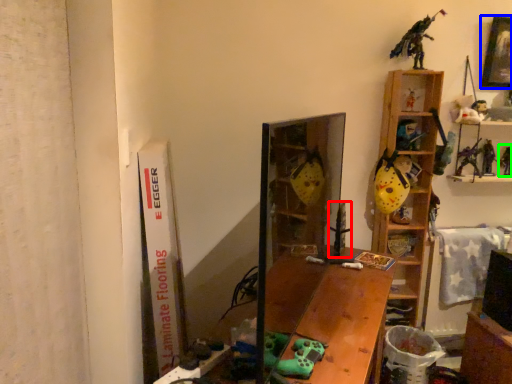
Question: Estimate the real-world distances between objects in this image. Which object is closer to toy (highlighted by a red box), picture frame (highlighted by a blue box) or toy (highlighted by a green box)?

Choices:
 (A) picture frame
 (B) toy

Answer: (B)